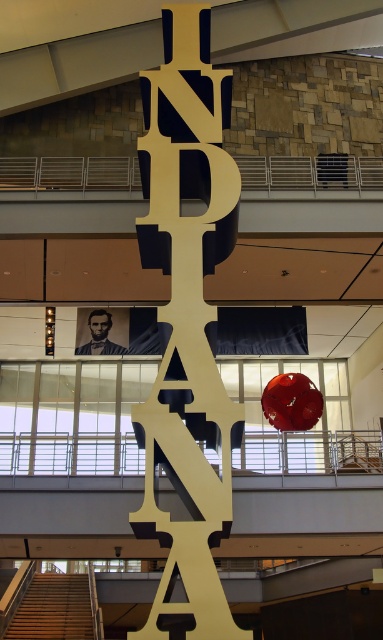
You are an architect designing a new exhibition space. You need to place a 15 meter long walkway between the gold metallic letters at center and the smooth skin portrait at center. Is this feasible based on the current layout?

The gold metallic letters at center and smooth skin portrait at center are 14.93 meters apart from each other. A 15 meter long walkway would be slightly too long to fit between them, so it might not be feasible unless adjustments are made to the placement or the walkway is shortened.